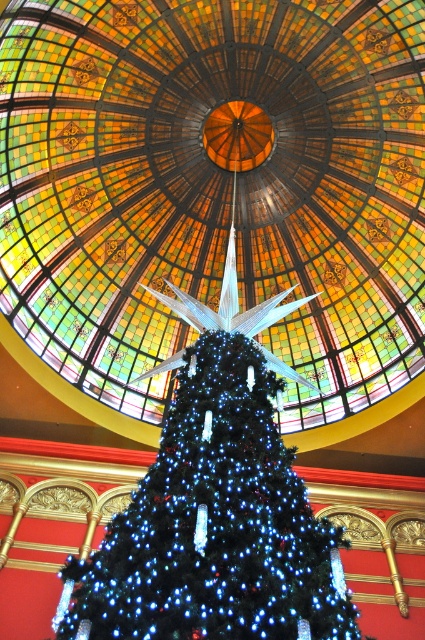
Does point (11, 74) come farther from viewer compared to point (178, 614)?

Yes.

Does stained glass dome at center have a smaller size compared to blue led lights at center?

No, stained glass dome at center is not smaller than blue led lights at center.

Which is in front, point (376, 275) or point (59, 611)?

Point (59, 611) is more forward.

Locate an element on the screen. The width and height of the screenshot is (425, 640). stained glass dome at center is located at coordinates (214, 186).